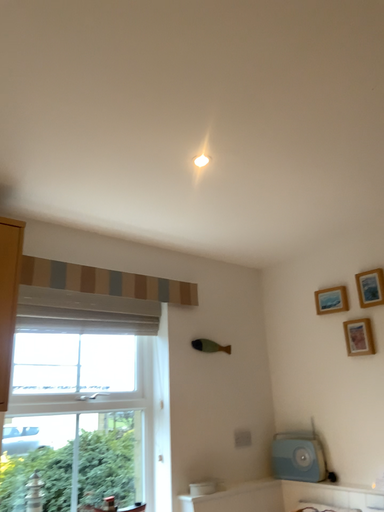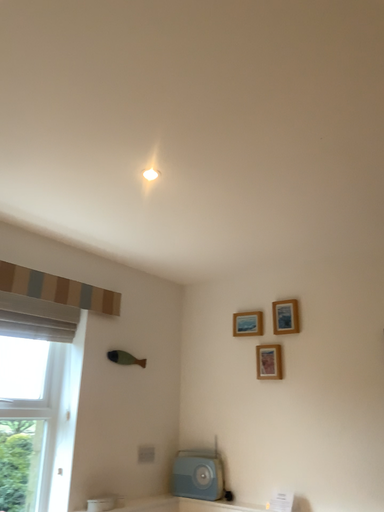
Question: How did the camera likely rotate when shooting the video?

Choices:
 (A) rotated left
 (B) rotated right

Answer: (B)